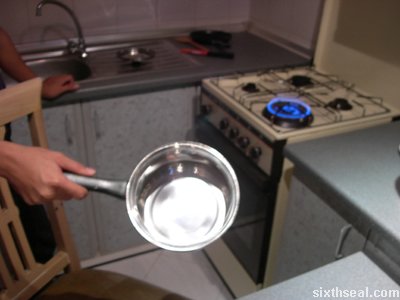
Image resolution: width=400 pixels, height=300 pixels. I want to click on faucet, so click(40, 6).